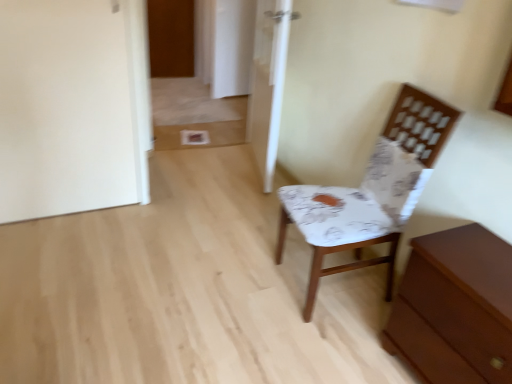
Identify the location of unoccupied area in front of white fabric chair at right. (317, 343).